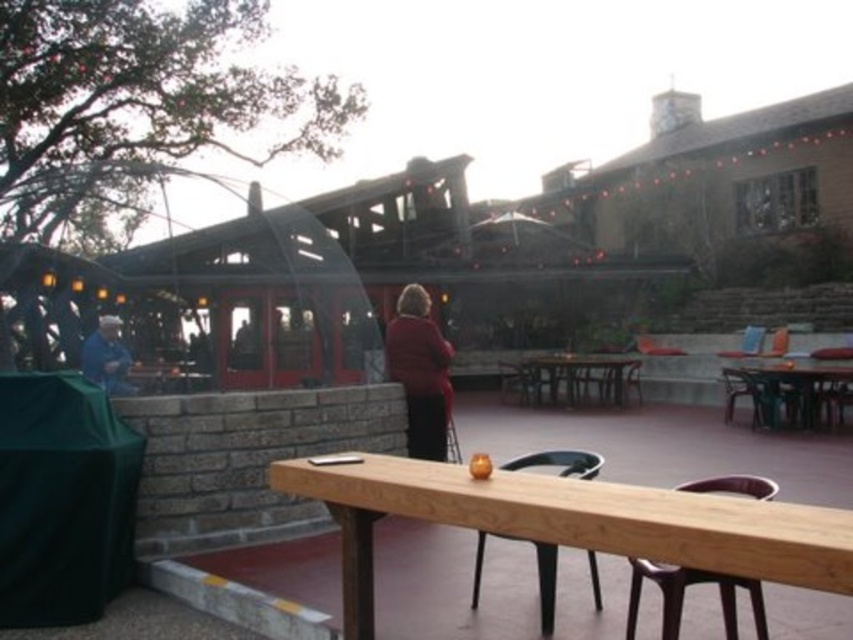
Is natural wood table at center bigger than wooden picnic table at right?

Incorrect, natural wood table at center is not larger than wooden picnic table at right.

This screenshot has height=640, width=853. Identify the location of natural wood table at center. (567, 524).

Find the location of `matte red coat at center`. matte red coat at center is located at coordinates (421, 372).

Is matte red coat at center above blue fabric at left?

Incorrect, matte red coat at center is not positioned above blue fabric at left.

This screenshot has height=640, width=853. Describe the element at coordinates (421, 372) in the screenshot. I see `matte red coat at center` at that location.

This screenshot has width=853, height=640. What are the coordinates of `matte red coat at center` in the screenshot? It's located at (421, 372).

Is wooden picnic table at right shorter than wooden picnic table at center?

Yes.

Is point (792, 417) positioned after point (605, 388)?

No, it is in front of (605, 388).

Find the location of a particular element. The height and width of the screenshot is (640, 853). wooden picnic table at right is located at coordinates (790, 390).